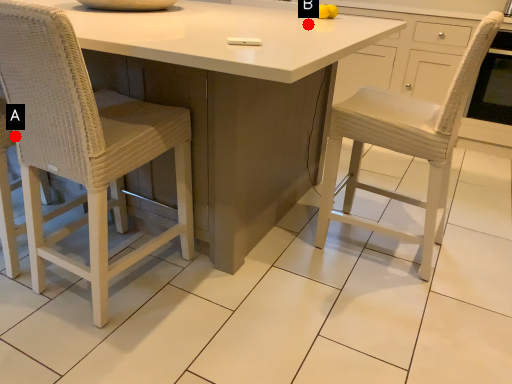
Question: Two points are circled on the image, labeled by A and B beside each circle. Which point appears closest to the camera in this image?

Choices:
 (A) A is closer
 (B) B is closer

Answer: (B)